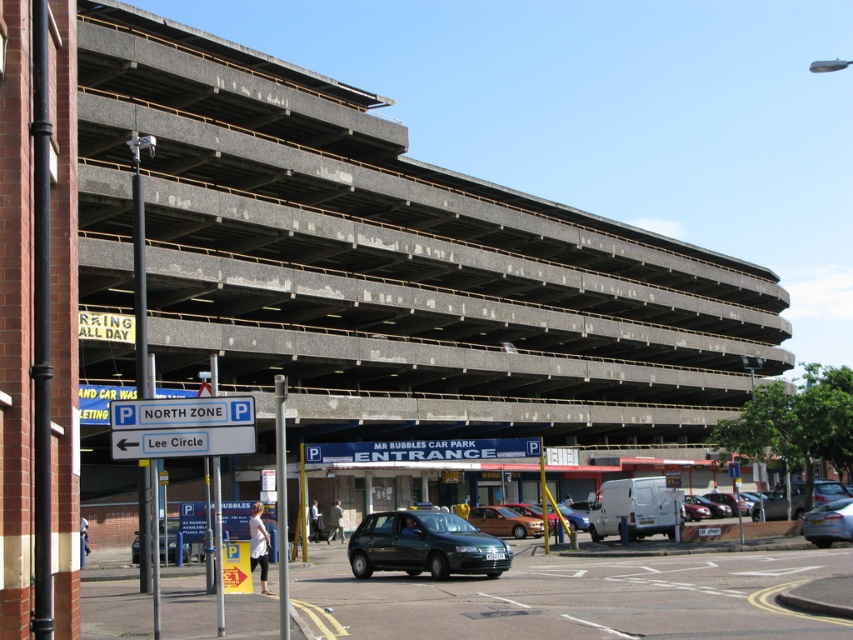
Looking at this image, you are driving a car and approaching the entrance of the car park. You see the blue plastic sign at lower left and the silver metallic sedan at lower right. Which object is closer to you as you drive towards the entrance?

The blue plastic sign at lower left is closer to the viewer than the silver metallic sedan at lower right, so the blue plastic sign at lower left is closer to you as you drive towards the entrance.